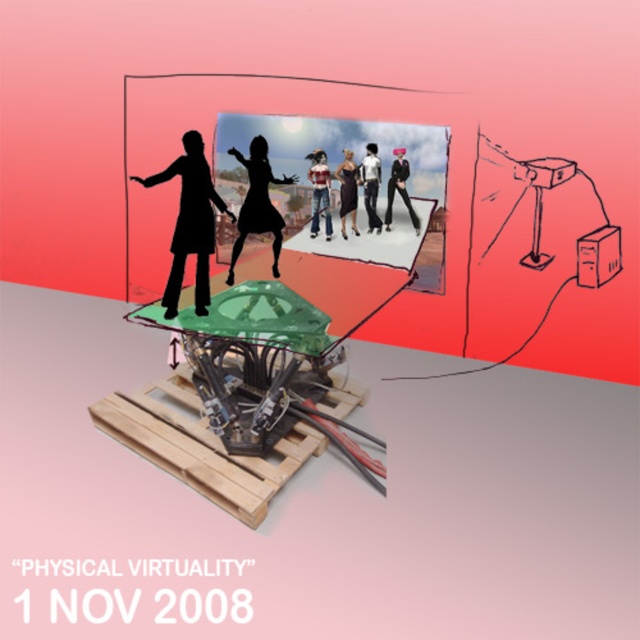
You are an art critic observing the installation in the foreground. You notice two central elements, the matte digital poster at center and the black matte dress at center. Which one appears closer to you in the artwork?

The matte digital poster at center is further to the viewer than the black matte dress at center, so the matte digital poster at center appears closer to you.